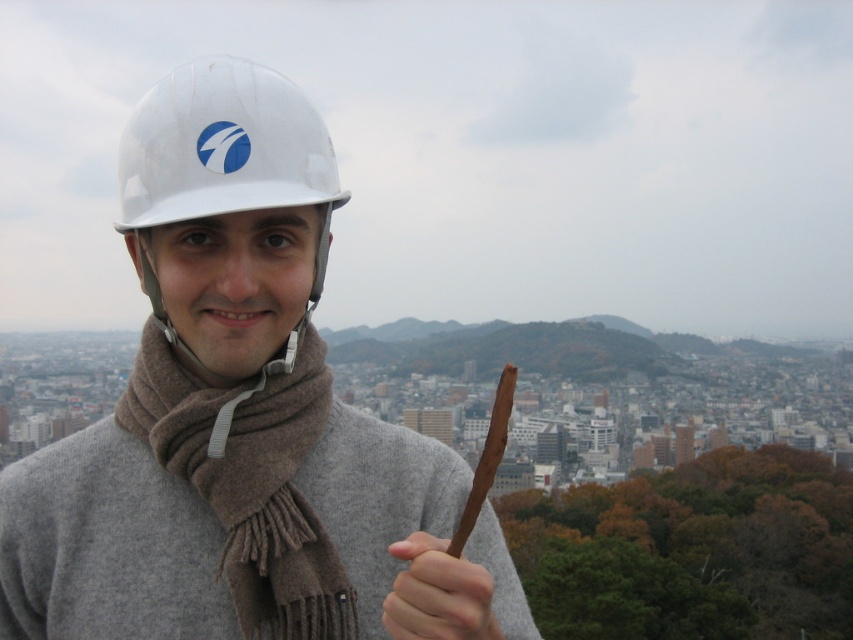
Question: Can you confirm if brown woolen scarf at center is smaller than smooth brown stick at center?

Choices:
 (A) yes
 (B) no

Answer: (B)

Question: Which object is the farthest from the matte white helmet at center?

Choices:
 (A) gray wool scarf at center
 (B) brown woolen scarf at center

Answer: (A)

Question: Does matte white helmet at center have a larger size compared to brown woolen scarf at center?

Choices:
 (A) yes
 (B) no

Answer: (A)

Question: Can you confirm if brown woolen scarf at center is positioned to the right of white matte helmet at upper center?

Choices:
 (A) yes
 (B) no

Answer: (A)

Question: Estimate the real-world distances between objects in this image. Which object is farther from the white matte helmet at upper center?

Choices:
 (A) matte white helmet at center
 (B) brown woolen scarf at center

Answer: (B)

Question: Which point is closer to the camera?

Choices:
 (A) (167, 490)
 (B) (457, 628)
 (C) (83, 563)
 (D) (262, 177)

Answer: (B)